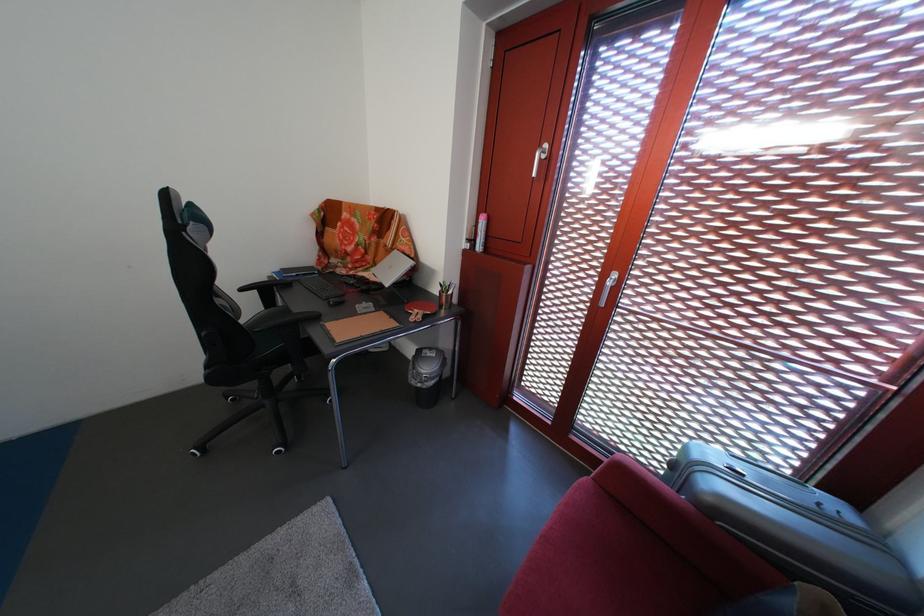
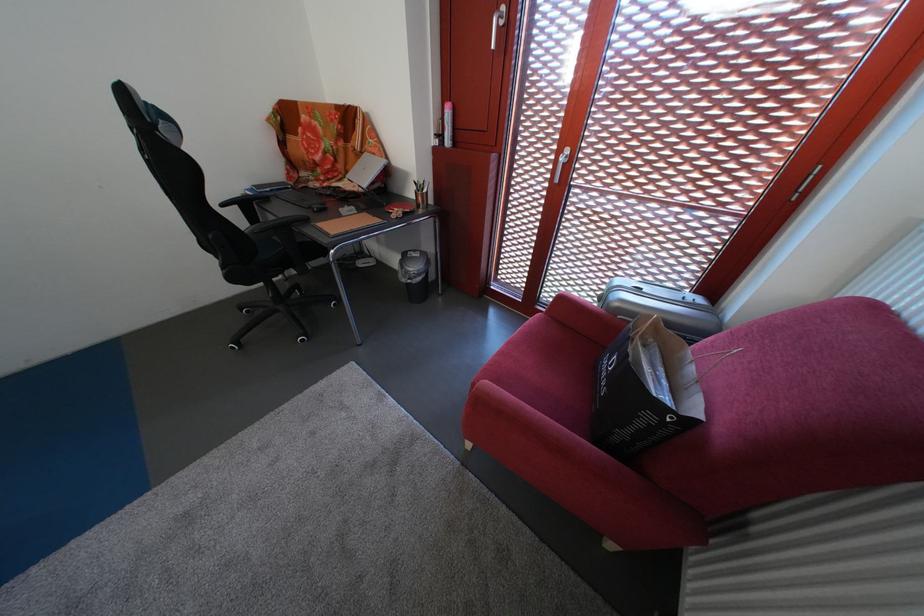
Question: The images are taken continuously from a first-person perspective. In which direction are you moving?

Choices:
 (A) Left
 (B) Right
 (C) Forward
 (D) Backward

Answer: (D)